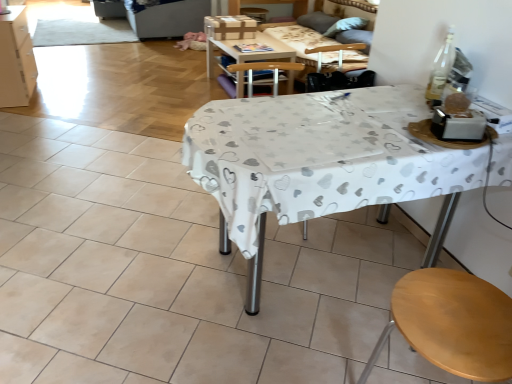
Question: Considering the relative sizes of brown cardboard box at upper center and wooden table at center in the image provided, is brown cardboard box at upper center smaller than wooden table at center?

Choices:
 (A) yes
 (B) no

Answer: (A)

Question: Does brown cardboard box at upper center come behind wooden table at center?

Choices:
 (A) no
 (B) yes

Answer: (B)

Question: Is brown cardboard box at upper center to the right of wooden table at center from the viewer's perspective?

Choices:
 (A) no
 (B) yes

Answer: (A)

Question: From the image's perspective, would you say brown cardboard box at upper center is shown under wooden table at center?

Choices:
 (A) yes
 (B) no

Answer: (B)

Question: From a real-world perspective, is brown cardboard box at upper center on wooden table at center?

Choices:
 (A) yes
 (B) no

Answer: (A)

Question: Does brown cardboard box at upper center appear on the left side of wooden table at center?

Choices:
 (A) yes
 (B) no

Answer: (A)

Question: Considering the relative sizes of wooden couch at upper center and wooden table at center in the image provided, is wooden couch at upper center shorter than wooden table at center?

Choices:
 (A) no
 (B) yes

Answer: (A)

Question: Can you confirm if wooden couch at upper center is bigger than wooden table at center?

Choices:
 (A) no
 (B) yes

Answer: (A)

Question: Is wooden couch at upper center facing away from wooden table at center?

Choices:
 (A) no
 (B) yes

Answer: (A)

Question: Does wooden couch at upper center lie behind wooden table at center?

Choices:
 (A) yes
 (B) no

Answer: (B)

Question: Is wooden couch at upper center not inside wooden table at center?

Choices:
 (A) no
 (B) yes

Answer: (B)

Question: From the image's perspective, is wooden couch at upper center on wooden table at center?

Choices:
 (A) yes
 (B) no

Answer: (B)

Question: From a real-world perspective, is white matte cabinet at left physically above wooden table at center?

Choices:
 (A) no
 (B) yes

Answer: (B)